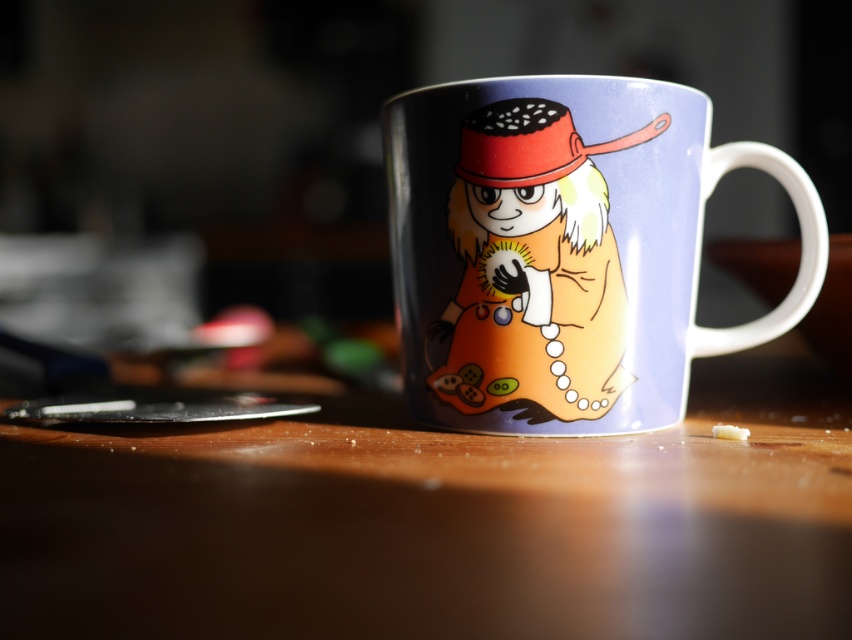
Can you confirm if wooden table at center is thinner than glossy ceramic mug at center?

In fact, wooden table at center might be wider than glossy ceramic mug at center.

Is wooden table at center taller than glossy ceramic mug at center?

No, wooden table at center is not taller than glossy ceramic mug at center.

Is point (309, 500) positioned behind point (732, 144)?

No, (309, 500) is in front of (732, 144).

You are a GUI agent. You are given a task and a screenshot of the screen. Output one action in this format:
    pyautogui.click(x=<x>, y=<y>)
    Task: Click on the wooden table at center
    The height and width of the screenshot is (640, 852).
    Given the screenshot: What is the action you would take?
    pyautogui.click(x=436, y=518)